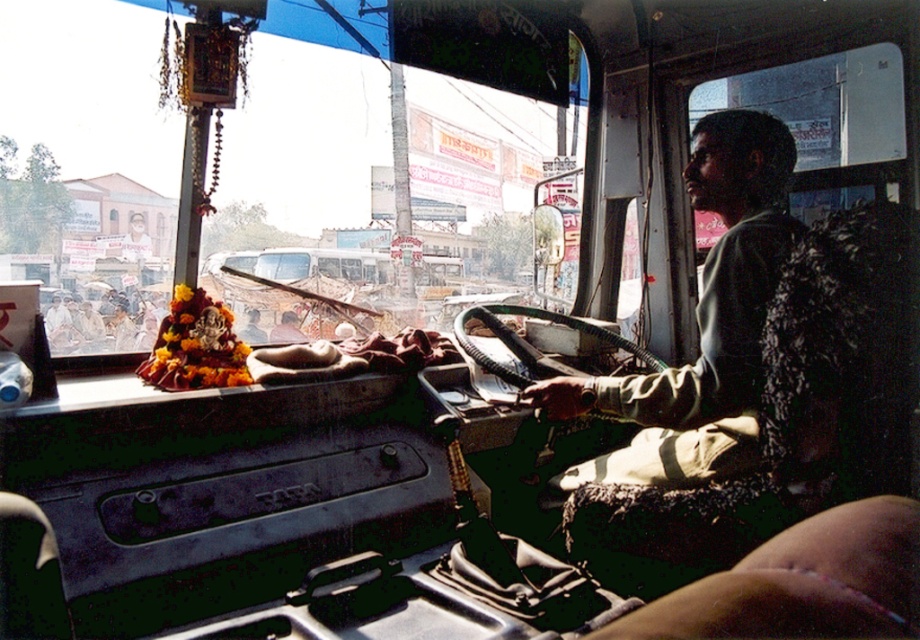
In the scene shown: You are standing at the driver seat of the bus and want to reach a point located at coordinates point (102, 161). Can you safely reach it without moving from your seat?

The point (102, 161) is 15.34 meters away from the camera, which is likely out of reach from the driver seat without moving. Therefore, the driver cannot safely reach it without moving from the seat.

Consider the image. You are a passenger sitting in the back of the bus and want to look outside through the transparent glass windshield at upper center. However, there is a smooth skin at lower right blocking your view. Can you determine which object is wider to decide if you can move the obstruction?

The transparent glass windshield at upper center is wider than smooth skin at lower right, so you can move the smooth skin at lower right to get a better view since it is narrower.